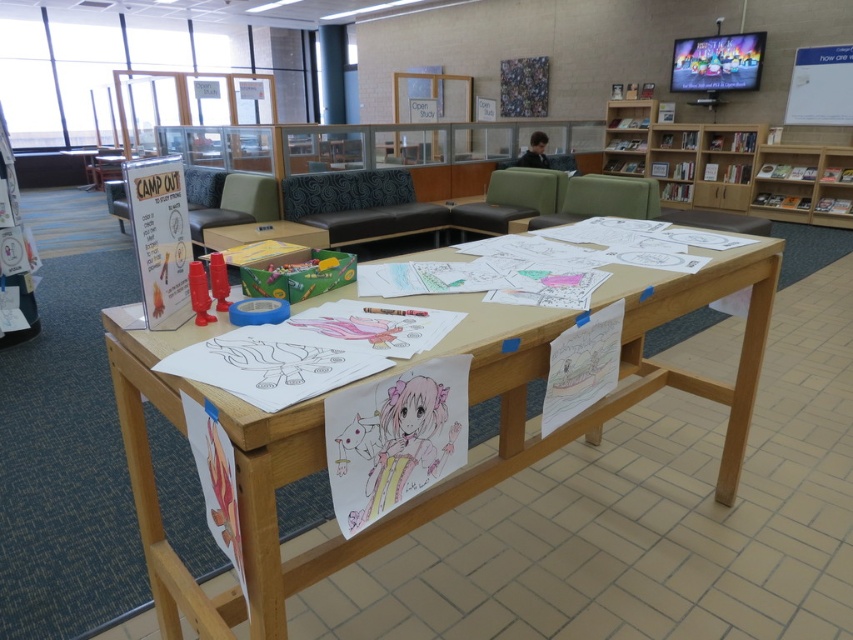
You are a student who needs to place a tall stack of books on the wooden table at center. Considering the height of the wooden bookshelf at upper right, will the stack of books risk falling off the table?

The wooden table at center has a lesser height compared to wooden bookshelf at upper right. Since the table is shorter, placing a tall stack of books might make them unstable and at risk of falling off.

You are a visitor in the library and want to find a book on camping. You see the wooden table at center and the wooden bookshelf at upper right. Which object is closer to you?

The wooden table at center is closer to you because it is in front of the wooden bookshelf at upper right.

You are a visitor in the library and want to place a new book on the wooden table at center and the wooden bookshelf at upper right. Which object should you approach first if you are standing to the left of both objects?

You should approach the wooden table at center first because it is positioned on the left side of the wooden bookshelf at upper right, making it closer to your current position on the left.